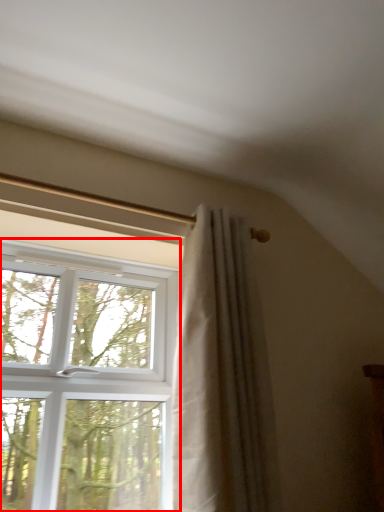
Question: Where is window (annotated by the red box) located in relation to curtain in the image?

Choices:
 (A) left
 (B) right

Answer: (A)